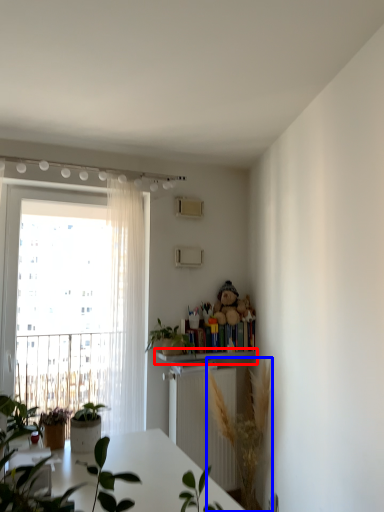
Question: Which of the following is the farthest to the observer, shelf (highlighted by a red box) or houseplant (highlighted by a blue box)?

Choices:
 (A) shelf
 (B) houseplant

Answer: (A)